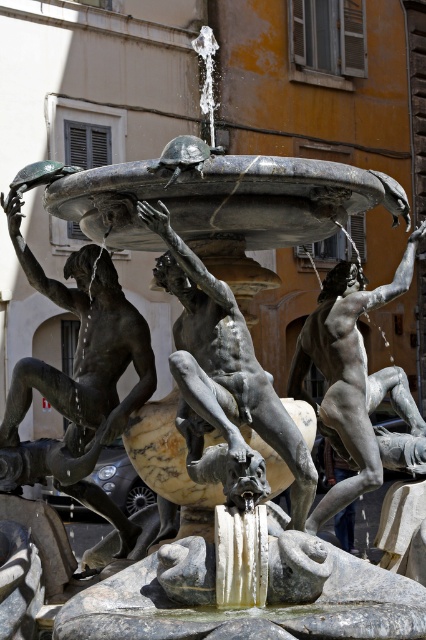
Between point (69, 410) and point (230, 369), which one is positioned behind?

Positioned behind is point (69, 410).

Is bronze statue at center below bronze muscular figure at center?

Yes.

The width and height of the screenshot is (426, 640). Describe the element at coordinates (83, 371) in the screenshot. I see `bronze statue at center` at that location.

Find the location of a particular element. bronze statue at center is located at coordinates (83, 371).

Can you confirm if bronze statue at center is smaller than polished silver statue at center?

Correct, bronze statue at center occupies less space than polished silver statue at center.

From the picture: Is bronze statue at center to the left of polished silver statue at center from the viewer's perspective?

Correct, you'll find bronze statue at center to the left of polished silver statue at center.

The width and height of the screenshot is (426, 640). Describe the element at coordinates (83, 371) in the screenshot. I see `bronze statue at center` at that location.

Find the location of `bronze statue at center`. bronze statue at center is located at coordinates (83, 371).

Does bronze muscular figure at center have a greater height compared to polished silver statue at center?

Yes.

Does bronze muscular figure at center appear on the right side of polished silver statue at center?

Incorrect, bronze muscular figure at center is not on the right side of polished silver statue at center.

What do you see at coordinates (224, 376) in the screenshot?
I see `bronze muscular figure at center` at bounding box center [224, 376].

This screenshot has width=426, height=640. Identify the location of bronze muscular figure at center. (224, 376).